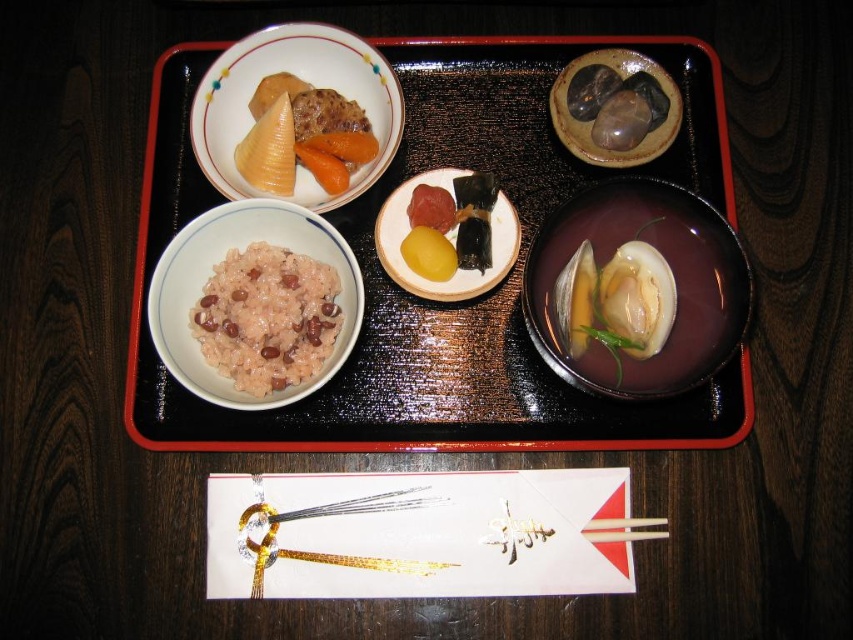
Question: Is pinkish-red raw fish at center bigger than white wood chopsticks at lower center?

Choices:
 (A) yes
 (B) no

Answer: (A)

Question: Which object is closer to the camera taking this photo?

Choices:
 (A) orange smooth carrot at upper left
 (B) matte yellow corn at upper left
 (C) matte ceramic bowl at upper left
 (D) smooth yellow rice cake at center

Answer: (C)

Question: Which of the following is the closest to the observer?

Choices:
 (A) (329, 193)
 (B) (456, 115)
 (C) (602, 541)

Answer: (C)

Question: Observing the image, what is the correct spatial positioning of matte yellow corn at upper left in reference to orange smooth carrot at upper left?

Choices:
 (A) below
 (B) above

Answer: (B)

Question: Considering the real-world distances, which object is farthest from the smooth yellow rice cake at center?

Choices:
 (A) pinkish-red raw fish at center
 (B) matte brown bowl at upper right
 (C) white wood chopsticks at lower center
 (D) brown matte rice at center

Answer: (C)

Question: Can you confirm if black glossy tray at center is positioned to the left of glossy ceramic bowl at center right?

Choices:
 (A) yes
 (B) no

Answer: (A)